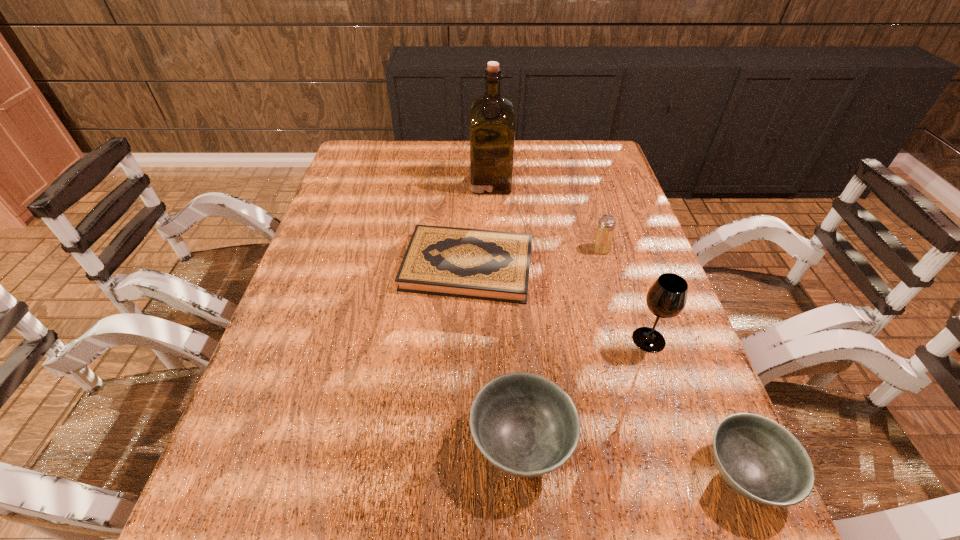
Considering the uniform spacing of bowls, where should an additional bowl be positioned on the left? Please locate a free spot. Please provide its 2D coordinates. Your answer should be formatted as a tuple, i.e. [(x, y)], where the tuple contains the x and y coordinates of a point satisfying the conditions above.

[(319, 414)]